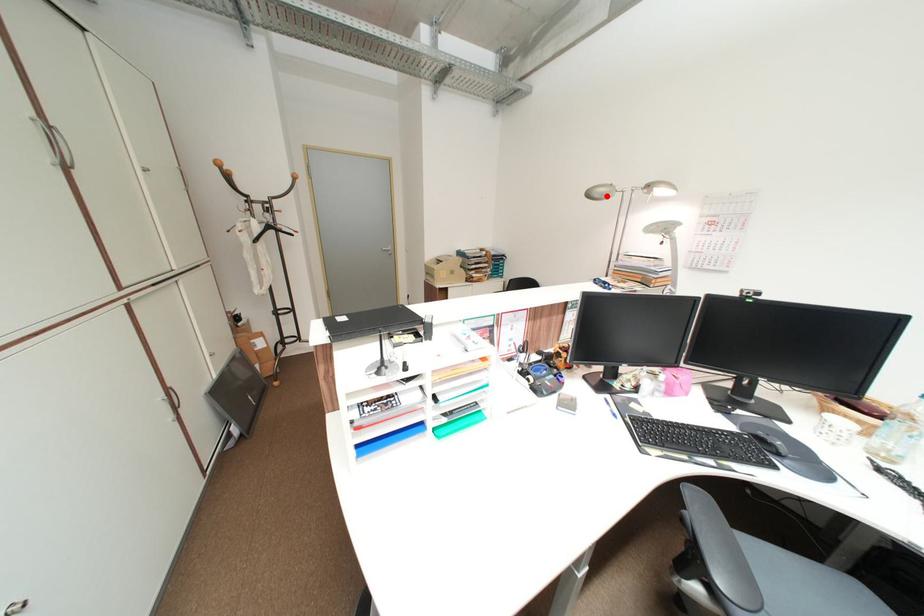
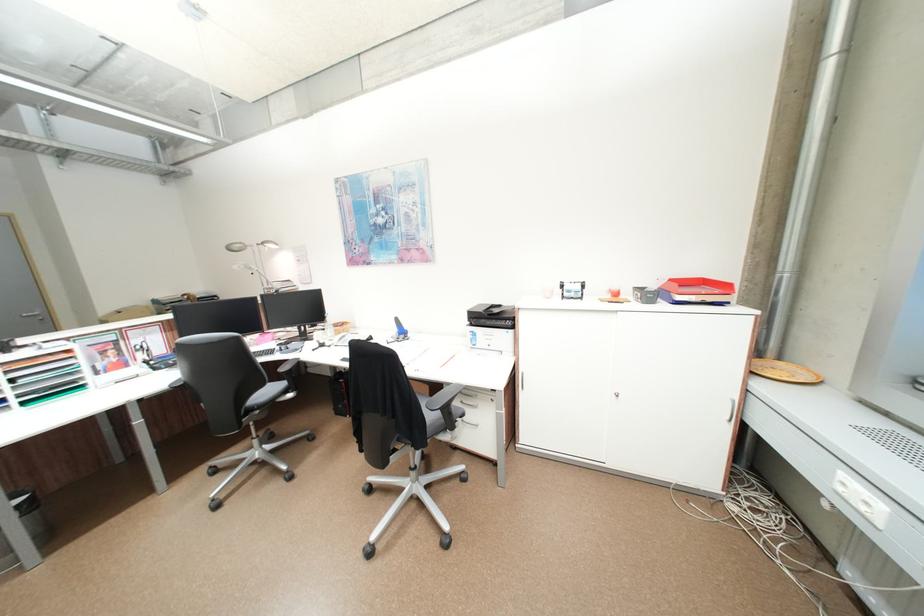
Locate, in the second image, the point that corresponds to the highlighted location in the first image.

(245, 249)